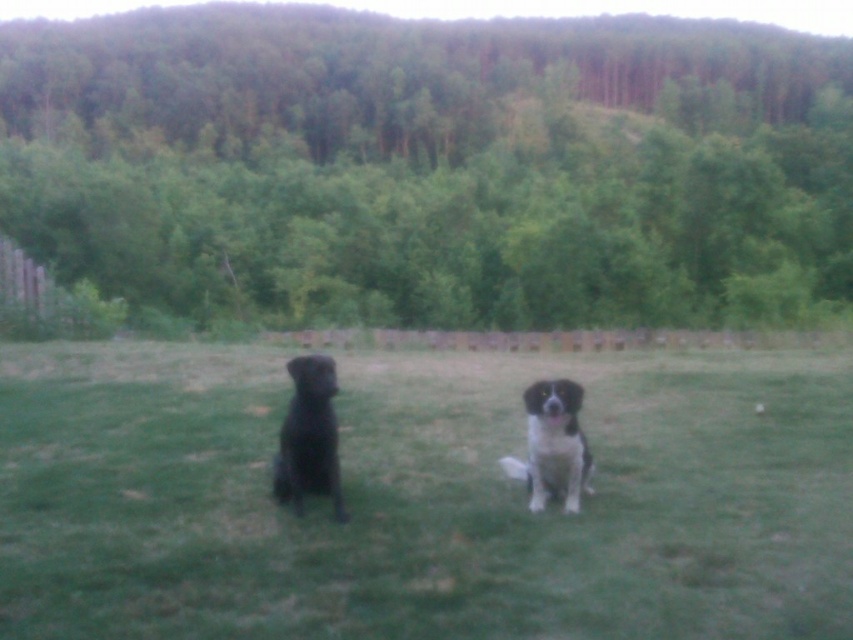
Does green leafy trees at upper center come in front of black fur dog at center?

No, green leafy trees at upper center is behind black fur dog at center.

The height and width of the screenshot is (640, 853). Describe the element at coordinates (431, 166) in the screenshot. I see `green leafy trees at upper center` at that location.

Find the location of a particular element. The width and height of the screenshot is (853, 640). green leafy trees at upper center is located at coordinates (431, 166).

Between green leafy trees at upper center and black and white fur dog at center, which one has more height?

Standing taller between the two is green leafy trees at upper center.

Is point (730, 134) positioned in front of point (558, 404)?

That is False.

Does point (555, 28) lie behind point (529, 428)?

Yes, it is behind point (529, 428).

This screenshot has width=853, height=640. I want to click on green leafy trees at upper center, so click(x=431, y=166).

Who is positioned more to the left, green leafy trees at upper center or black matte dog at left?

green leafy trees at upper center

Does green leafy trees at upper center have a greater height compared to black matte dog at left?

Correct, green leafy trees at upper center is much taller as black matte dog at left.

Find the location of a particular element. This screenshot has width=853, height=640. green leafy trees at upper center is located at coordinates (431, 166).